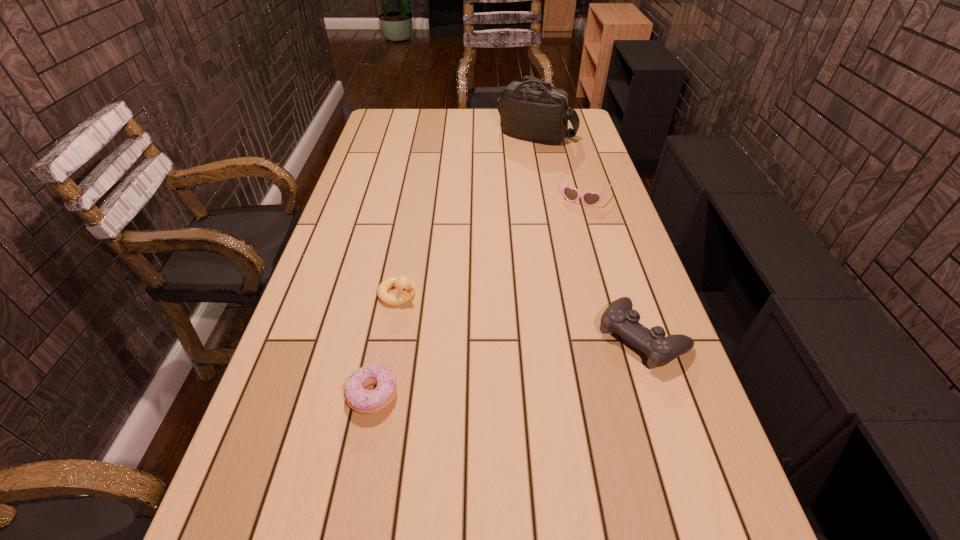
The image size is (960, 540). I want to click on free spot located on the front-facing side of the second farthest object, so click(x=543, y=279).

Identify the location of vacant area situated 0.280m at the beak of the duckling. The image size is (960, 540). (502, 353).

Image resolution: width=960 pixels, height=540 pixels. Find the location of `vacant region located at the beak of the duckling`. vacant region located at the beak of the duckling is located at coordinates (470, 335).

At what (x,y) coordinates should I click in order to perform the action: click on free region located 0.360m at the beak of the duckling. Please return your answer as a coordinate pair (x, y). This screenshot has height=540, width=960. Looking at the image, I should click on (531, 370).

At what (x,y) coordinates should I click in order to perform the action: click on vacant region located at the front padded panel of the shoulder bag. Please return your answer as a coordinate pair (x, y). The width and height of the screenshot is (960, 540). Looking at the image, I should click on (516, 205).

Locate an element on the screen. vacant region located at the front padded panel of the shoulder bag is located at coordinates (516, 205).

Where is `free spot located at the front padded panel of the shoulder bag`? Image resolution: width=960 pixels, height=540 pixels. free spot located at the front padded panel of the shoulder bag is located at coordinates (516, 205).

Where is `object at the far edge`? This screenshot has height=540, width=960. object at the far edge is located at coordinates (538, 113).

Where is `control that is at the right edge`? This screenshot has width=960, height=540. control that is at the right edge is located at coordinates (619, 317).

The image size is (960, 540). In order to click on sunglasses located in the right edge section of the desktop in this screenshot , I will do `click(589, 198)`.